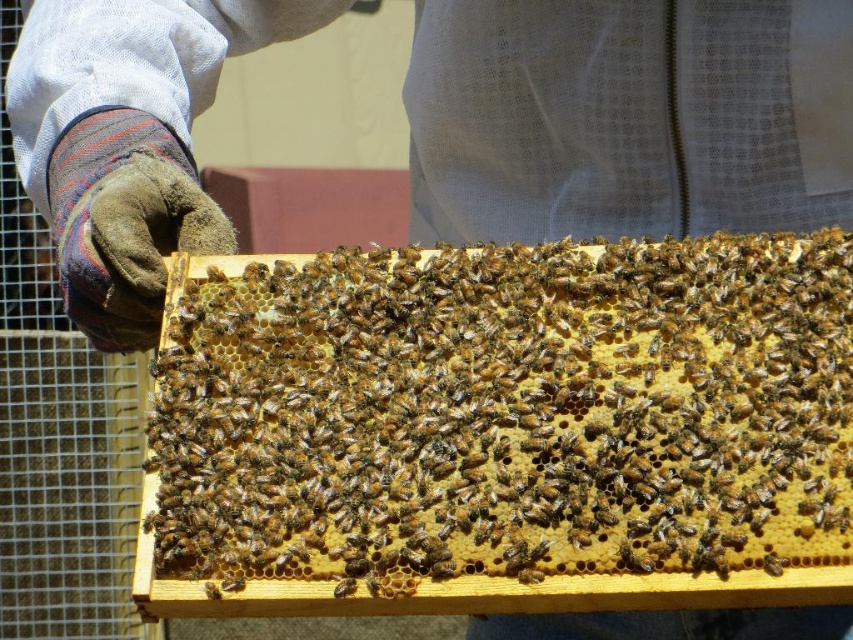
Question: Estimate the real-world distances between objects in this image. Which object is closer to the white mesh suit at center?

Choices:
 (A) brown wooden beehive at center
 (B) brown fuzzy bee at center

Answer: (A)

Question: Is brown wooden beehive at center below brown fuzzy bee at center?

Choices:
 (A) no
 (B) yes

Answer: (A)

Question: Is brown wooden beehive at center smaller than white mesh suit at center?

Choices:
 (A) no
 (B) yes

Answer: (B)

Question: Can you confirm if brown wooden beehive at center is wider than brown fuzzy bee at center?

Choices:
 (A) no
 (B) yes

Answer: (B)

Question: Which object is closer to the camera taking this photo?

Choices:
 (A) brown fuzzy bee at center
 (B) brown wooden beehive at center

Answer: (B)

Question: Which object appears farthest from the camera in this image?

Choices:
 (A) brown fuzzy bee at center
 (B) brown wooden beehive at center

Answer: (A)